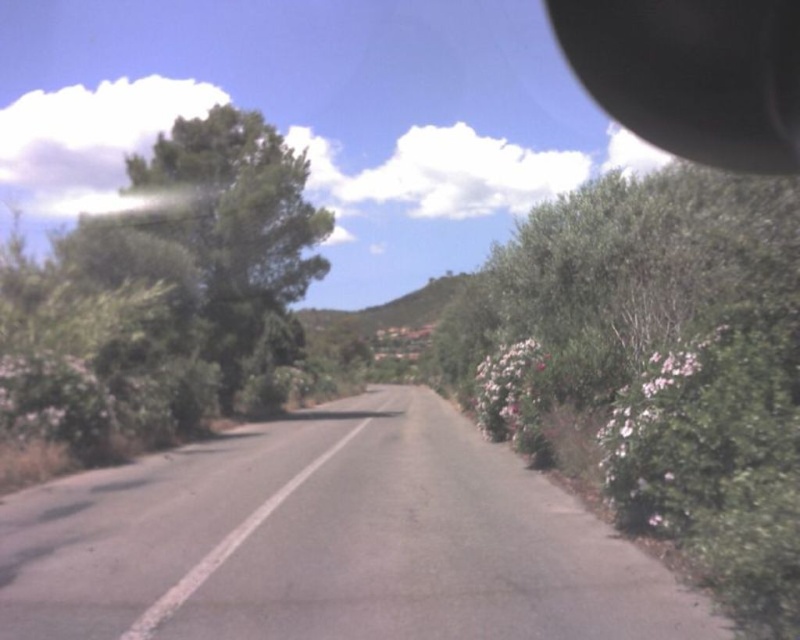
You are driving a car on the rural road and see two points marked on your GPS. The first point is at point (236, 204) and the second point is at point (516, 424). According to the image, which point is closer to your current position?

Point (516, 424) is closer to your current position because it is in front of point (236, 204), which is behind it.

You are driving a car and notice a green leafy bush at right and a black rubber view mirror at upper right in your rearview mirror. Which object is closer to the car?

The green leafy bush at right is closer to the car because it is located below the black rubber view mirror at upper right in the rearview mirror, indicating it is nearer to the observer.